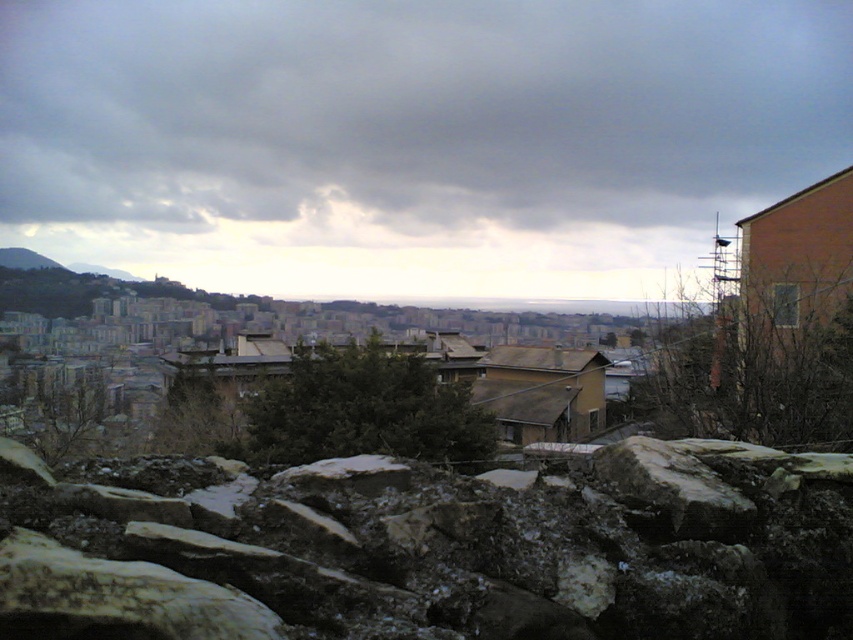
Is dark gray cloud at upper center to the left of rough stone wall at lower center from the viewer's perspective?

Yes, dark gray cloud at upper center is to the left of rough stone wall at lower center.

Between dark gray cloud at upper center and rough stone wall at lower center, which one has more height?

dark gray cloud at upper center

Does point (111, 177) lie in front of point (640, 442)?

That is False.

The height and width of the screenshot is (640, 853). I want to click on dark gray cloud at upper center, so click(x=412, y=122).

Between point (305, 627) and point (630, 467), which one is positioned behind?

The point (630, 467) is more distant.

Measure the distance between rough stone wall at lower center and white rough stone at center.

rough stone wall at lower center and white rough stone at center are 27.53 inches apart.

Does point (664, 545) lie in front of point (743, 496)?

Yes, point (664, 545) is in front of point (743, 496).

This screenshot has height=640, width=853. Identify the location of rough stone wall at lower center. (430, 547).

Based on the photo, who is more forward, (843,109) or (741,529)?

Point (741,529) is more forward.

Can you confirm if dark gray cloud at upper center is positioned to the right of white rough stone at center?

In fact, dark gray cloud at upper center is to the left of white rough stone at center.

Measure the distance between point (222, 60) and camera.

Point (222, 60) is 179.73 meters away from camera.

This screenshot has height=640, width=853. I want to click on dark gray cloud at upper center, so click(x=412, y=122).